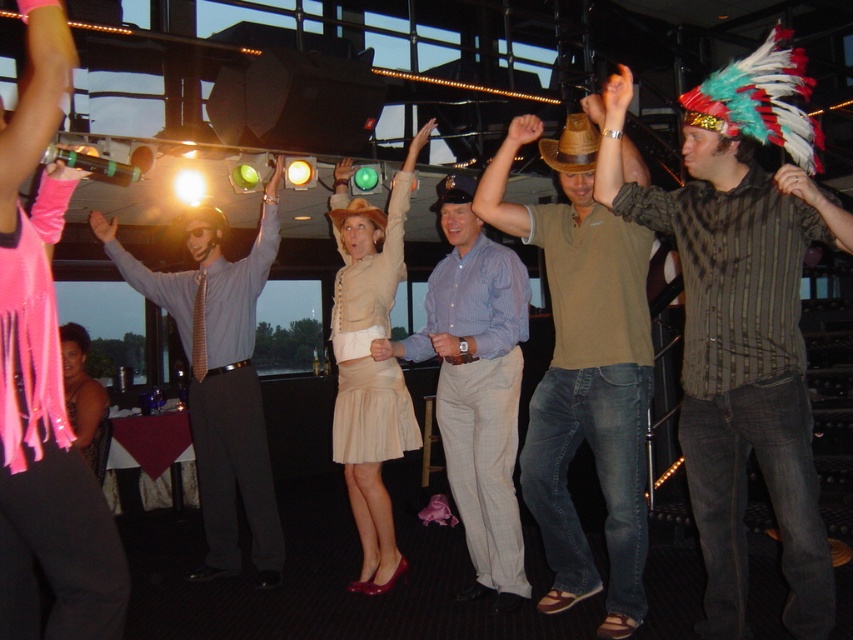
You are a photographer at the dance club and want to capture a photo of the matte brown hat at center and the white matte hand at center. Which object should you focus on first if you want to ensure both are in sharp focus?

The matte brown hat at center is taller than the white matte hand at center, so focusing on the taller matte brown hat at center first would help ensure both are in sharp focus.

You are standing at the entrance of the dance club and want to reach the DJ booth located at point (96, 224). There is a barrier at point (791, 589) blocking your path. Can you walk around the barrier to reach the DJ booth?

Answer: Point (791, 589) is closer to the viewer than point (96, 224), so the barrier at point (791, 589) is in front of the DJ booth. You can walk around the barrier to reach the DJ booth since it is closer to you.